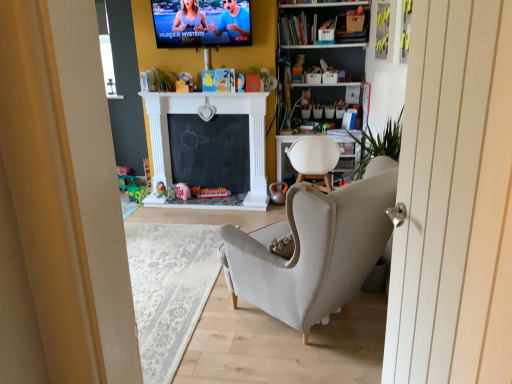
Question: Does matte plastic tv at upper center have a smaller size compared to pink fabric toy at center, arranged as the 3th toy when viewed from the right?

Choices:
 (A) no
 (B) yes

Answer: (A)

Question: Is matte plastic tv at upper center facing towards pink fabric toy at center, arranged as the 3th toy when viewed from the right?

Choices:
 (A) yes
 (B) no

Answer: (B)

Question: Does matte plastic tv at upper center contain pink fabric toy at center, arranged as the 3th toy when viewed from the right?

Choices:
 (A) yes
 (B) no

Answer: (B)

Question: Is matte plastic tv at upper center positioned with its back to pink fabric toy at center, the 3th toy from the left?

Choices:
 (A) yes
 (B) no

Answer: (B)

Question: From the image's perspective, is matte plastic tv at upper center below pink fabric toy at center, arranged as the 3th toy when viewed from the right?

Choices:
 (A) no
 (B) yes

Answer: (A)

Question: Considering the positions of green plastic toy at lower left, which is counted as the 5th toy, starting from the right, and metallic silver toy at center, placed as the fifth toy when sorted from left to right, in the image, is green plastic toy at lower left, which is counted as the 5th toy, starting from the right, bigger or smaller than metallic silver toy at center, placed as the fifth toy when sorted from left to right,?

Choices:
 (A) big
 (B) small

Answer: (B)

Question: Relative to metallic silver toy at center, which is counted as the 1th toy, starting from the right, is green plastic toy at lower left, marked as the 1th toy in a left-to-right arrangement, in front or behind?

Choices:
 (A) front
 (B) behind

Answer: (B)

Question: Do you think green plastic toy at lower left, marked as the 1th toy in a left-to-right arrangement, is within metallic silver toy at center, which is counted as the 1th toy, starting from the right, or outside of it?

Choices:
 (A) outside
 (B) inside

Answer: (A)

Question: From the image's perspective, relative to metallic silver toy at center, placed as the fifth toy when sorted from left to right, is green plastic toy at lower left, which is counted as the 5th toy, starting from the right, above or below?

Choices:
 (A) below
 (B) above

Answer: (A)

Question: Is metallic silver toy at center, placed as the fifth toy when sorted from left to right, bigger or smaller than translucent plastic toy at center, which is counted as the 2th toy, starting from the left?

Choices:
 (A) big
 (B) small

Answer: (A)

Question: Considering their positions, is metallic silver toy at center, which is counted as the 1th toy, starting from the right, located in front of or behind translucent plastic toy at center, the 4th toy positioned from the right?

Choices:
 (A) front
 (B) behind

Answer: (A)

Question: In terms of height, does metallic silver toy at center, which is counted as the 1th toy, starting from the right, look taller or shorter compared to translucent plastic toy at center, the 4th toy positioned from the right?

Choices:
 (A) short
 (B) tall

Answer: (B)

Question: Considering the positions of point (269, 198) and point (157, 188), is point (269, 198) closer or farther from the camera than point (157, 188)?

Choices:
 (A) farther
 (B) closer

Answer: (B)

Question: Is white fabric chair at center inside or outside of matte pink piggy bank at center, the second toy in the right-to-left sequence?

Choices:
 (A) outside
 (B) inside

Answer: (A)

Question: From the image's perspective, relative to matte pink piggy bank at center, the second toy in the right-to-left sequence, is white fabric chair at center above or below?

Choices:
 (A) above
 (B) below

Answer: (A)